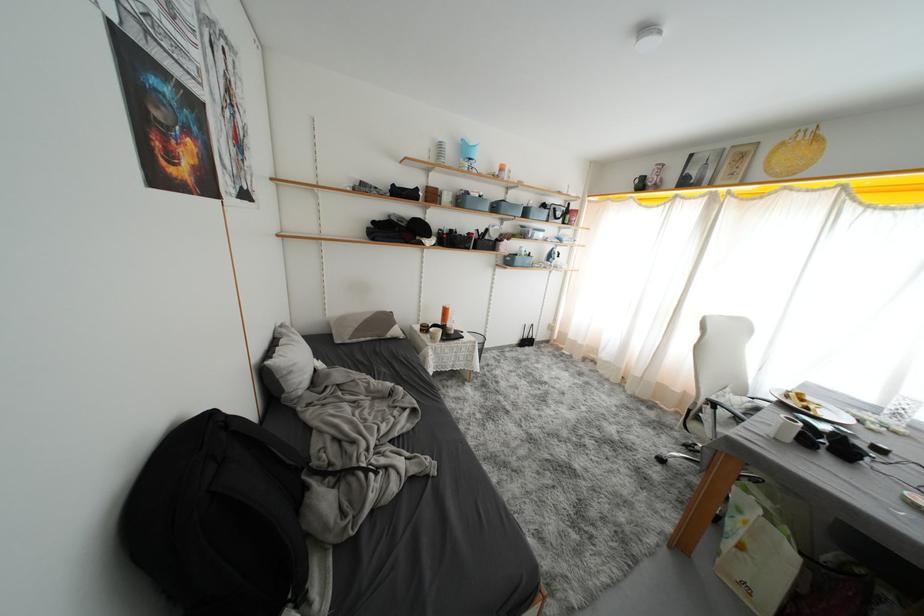
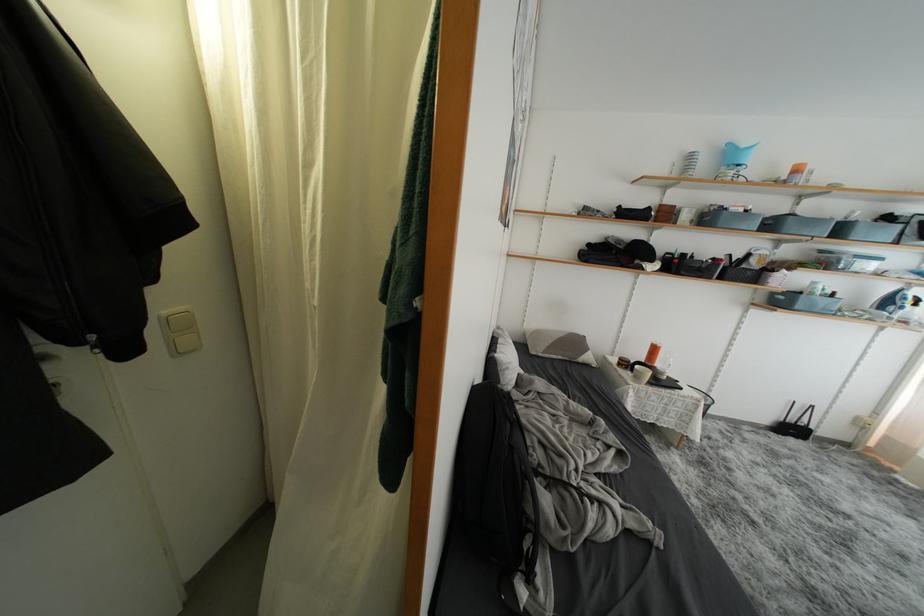
The point at (532, 346) is marked in the first image. Where is the corresponding point in the second image?

(797, 434)